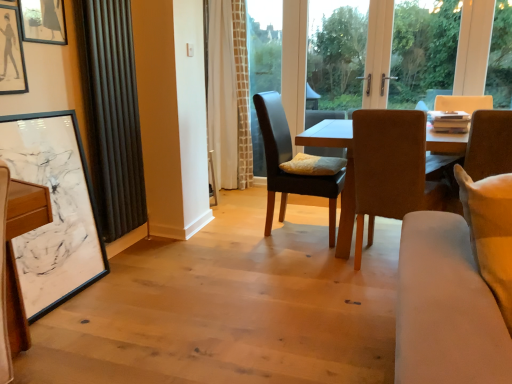
Question: Is leather cushioned chair at center, which appears as the third chair when viewed from the right, in contact with light beige fabric couch at lower right?

Choices:
 (A) no
 (B) yes

Answer: (A)

Question: Is the depth of leather cushioned chair at center, which appears as the third chair when viewed from the right, less than that of light beige fabric couch at lower right?

Choices:
 (A) yes
 (B) no

Answer: (B)

Question: Is leather cushioned chair at center, which appears as the third chair when viewed from the right, far away from light beige fabric couch at lower right?

Choices:
 (A) no
 (B) yes

Answer: (B)

Question: From the image's perspective, does leather cushioned chair at center, which appears as the third chair when viewed from the right, appear higher than light beige fabric couch at lower right?

Choices:
 (A) no
 (B) yes

Answer: (B)

Question: Is leather cushioned chair at center, which appears as the third chair when viewed from the right, behind light beige fabric couch at lower right?

Choices:
 (A) no
 (B) yes

Answer: (B)

Question: Is soft yellow pillow at center inside the boundaries of suede brown chair at center, which is the second chair in left-to-right order, or outside?

Choices:
 (A) inside
 (B) outside

Answer: (B)

Question: Is point (311, 160) positioned closer to the camera than point (451, 168)?

Choices:
 (A) closer
 (B) farther

Answer: (B)

Question: From a real-world perspective, is soft yellow pillow at center above or below suede brown chair at center, which is the second chair in left-to-right order?

Choices:
 (A) above
 (B) below

Answer: (A)

Question: Considering their positions, is soft yellow pillow at center located in front of or behind suede brown chair at center, acting as the second chair starting from the right?

Choices:
 (A) behind
 (B) front

Answer: (A)

Question: Is black matte picture frame at upper left, placed as the 2th picture frame when sorted from top to bottom, spatially inside leather cushioned chair at center, the 1th chair in the left-to-right sequence, or outside of it?

Choices:
 (A) outside
 (B) inside

Answer: (A)

Question: In the image, is black matte picture frame at upper left, placed as the 2th picture frame when sorted from top to bottom, positioned in front of or behind leather cushioned chair at center, which appears as the third chair when viewed from the right?

Choices:
 (A) behind
 (B) front

Answer: (B)

Question: Is black matte picture frame at upper left, marked as the 2th picture frame in a bottom-to-top arrangement, taller or shorter than leather cushioned chair at center, the 1th chair in the left-to-right sequence?

Choices:
 (A) tall
 (B) short

Answer: (B)

Question: Considering the positions of black matte picture frame at upper left, marked as the 2th picture frame in a bottom-to-top arrangement, and leather cushioned chair at center, which appears as the third chair when viewed from the right, in the image, is black matte picture frame at upper left, marked as the 2th picture frame in a bottom-to-top arrangement, bigger or smaller than leather cushioned chair at center, which appears as the third chair when viewed from the right,?

Choices:
 (A) small
 (B) big

Answer: (A)

Question: From a real-world perspective, is suede brown chair at center, which is the second chair in left-to-right order, positioned above or below white textured curtain at center, the first curtain positioned from the right?

Choices:
 (A) above
 (B) below

Answer: (B)

Question: From the image's perspective, relative to white textured curtain at center, which is counted as the first curtain, starting from the back, is suede brown chair at center, acting as the second chair starting from the right, above or below?

Choices:
 (A) below
 (B) above

Answer: (A)